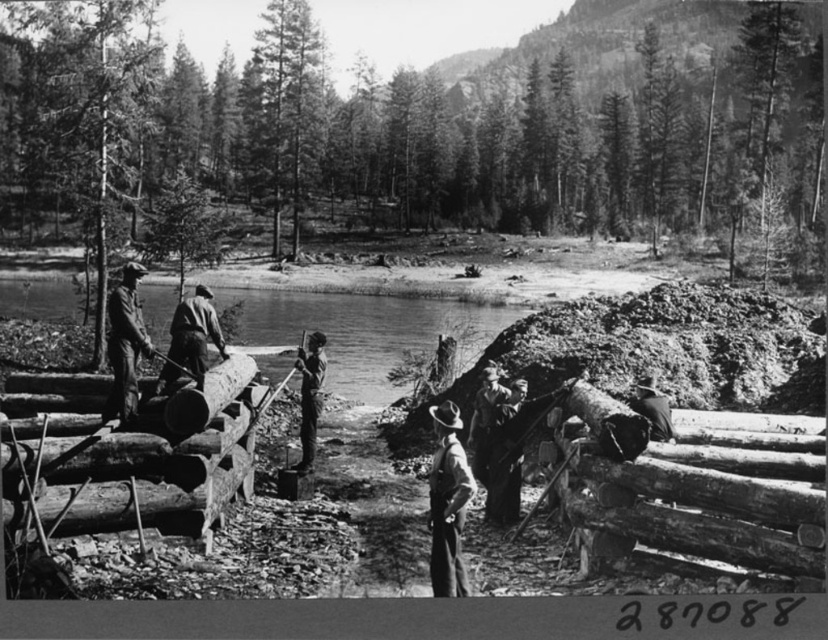
You are a photographer analyzing this black and white photo. You notice two hats in the scene. Which hat, the smooth brown hat at center or the matte black hat at left, has a greater height?

The smooth brown hat at center is taller than the matte black hat at left.

You are a photographer analyzing this black and white image. You notice the matte black hat at left and the smooth wooden log at center. Based on their positions, which object is closer to the camera?

The matte black hat at left is above the smooth wooden log at center, so it is closer to the camera.

You are a photographer standing at the edge of the river in the logging scene. You want to take a photo that includes both the point at coordinates point (455,570) and point (112,355). Which point should you focus on first to ensure both are in sharp focus?

You should focus on point (455,570) first because it is closer to you than point (112,355). This ensures the closer point is in focus, and the farther point will also be within the depth of field.